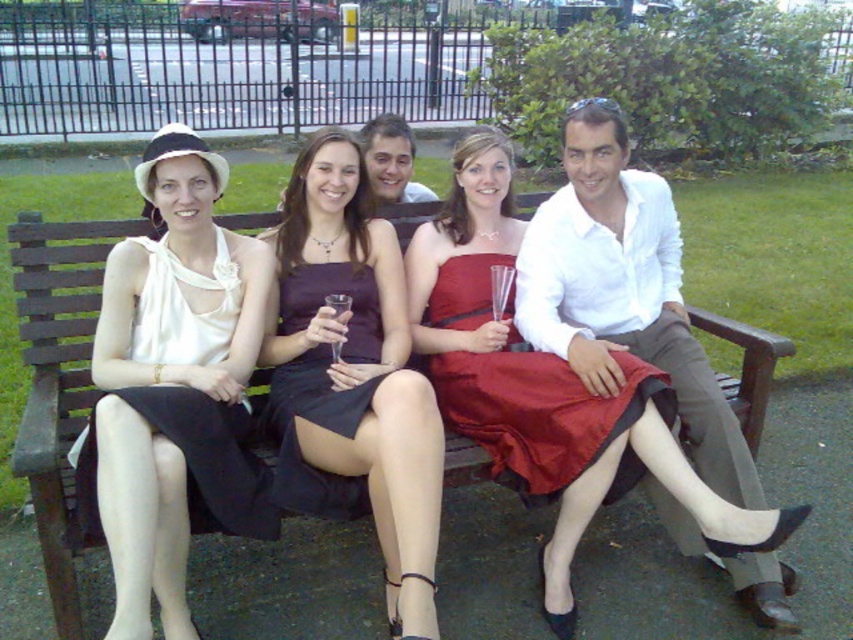
Is brown wooden bench at center positioned in front of dark purple satin dress at center?

Yes.

Between brown wooden bench at center and dark purple satin dress at center, which one is positioned higher?

Positioned higher is dark purple satin dress at center.

Is point (41, 353) positioned after point (299, 376)?

No, it is not.

Identify the location of brown wooden bench at center. (56, 376).

Is matte purple dress at center positioned at the back of dark purple satin dress at center?

No, it is not.

Which of these two, matte purple dress at center or dark purple satin dress at center, stands shorter?

dark purple satin dress at center

Between point (299, 221) and point (309, 316), which one is positioned in front?

Point (309, 316)

Find the location of a particular element. matte purple dress at center is located at coordinates (352, 376).

Can you confirm if matte white dress at left is shorter than brown wooden bench at center?

No.

Is matte white dress at left thinner than brown wooden bench at center?

No.

Which is behind, point (209, 392) or point (73, 561)?

The point (209, 392) is behind.

Where is `matte white dress at left`? This screenshot has height=640, width=853. matte white dress at left is located at coordinates (175, 385).